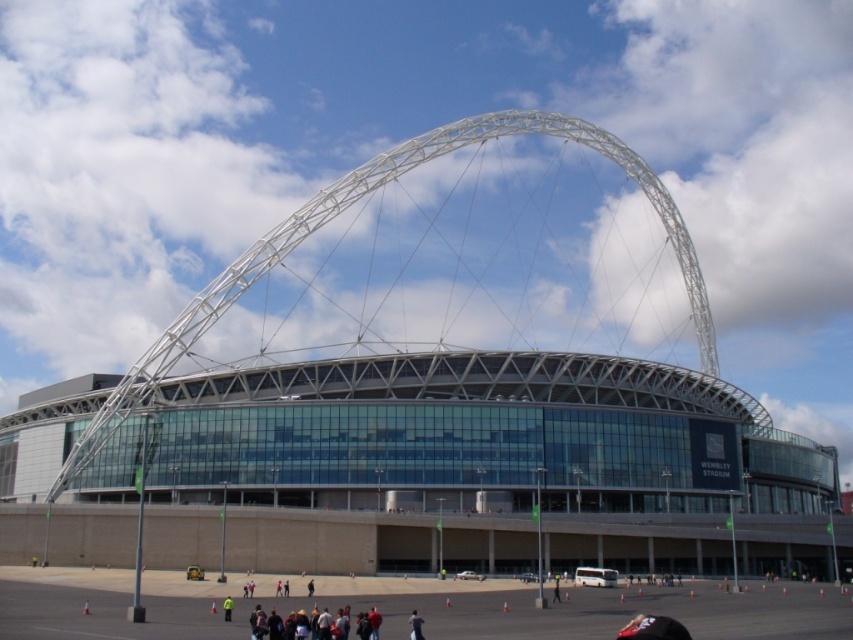
Question: Which point is closer to the camera?

Choices:
 (A) dark brown leather jacket at lower center
 (B) dark gray fabric group at lower center

Answer: (B)

Question: Can you confirm if dark gray fabric group at lower center is smaller than dark brown leather jacket at lower center?

Choices:
 (A) yes
 (B) no

Answer: (B)

Question: Can you confirm if dark gray fabric group at lower center is bigger than dark brown leather jacket at lower center?

Choices:
 (A) yes
 (B) no

Answer: (A)

Question: Can you confirm if dark gray fabric group at lower center is positioned to the left of dark brown leather jacket at lower center?

Choices:
 (A) yes
 (B) no

Answer: (A)

Question: Which point is farther from the camera taking this photo?

Choices:
 (A) (410, 620)
 (B) (318, 627)

Answer: (A)